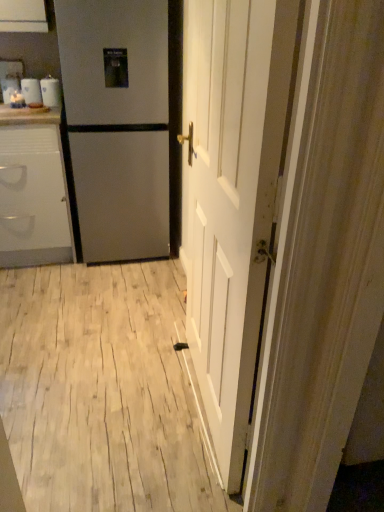
Locate an element on the screen. This screenshot has width=384, height=512. vacant region above white wood floor at center (from a real-world perspective) is located at coordinates (92, 336).